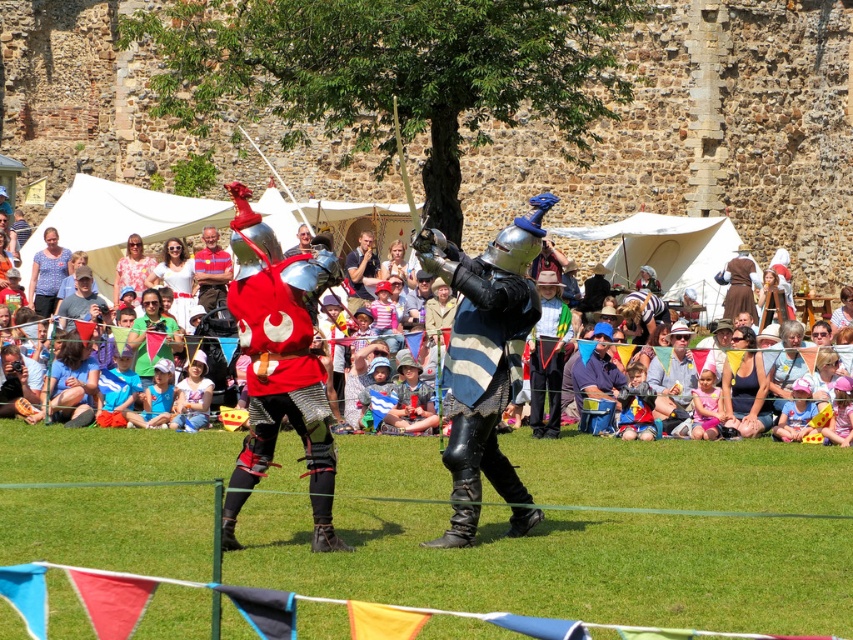
You are a knight in the medieval event and you see the shiny silver armor at center. If you want to move towards it from the left side of the image, which direction should you walk?

The shiny silver armor at center is located at point (485, 356), so you should walk towards the center of the image from the left side.